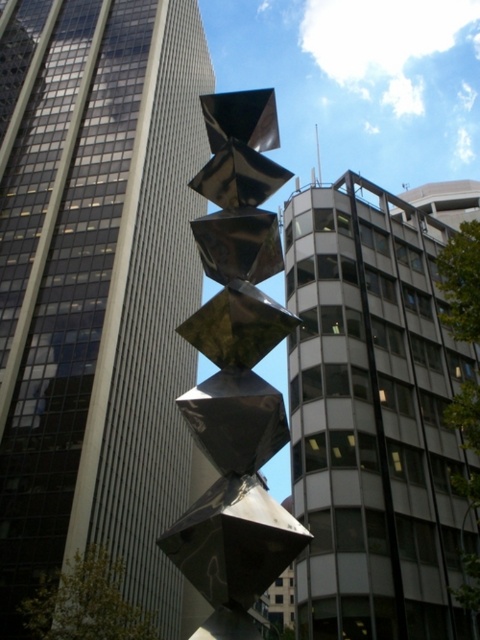
You are standing at the origin point in the urban setting. The smooth glass skyscraper at center is at coordinates 0.450, 0.204. If you want to walk directly towards it, in which cardinal direction should you head?

The smooth glass skyscraper at center is located at point (97, 288). Since the coordinate system typically has the origin at the bottom left, moving towards positive x increases eastward and positive y increases northward. Thus, to reach the skyscraper at (97, 288) from the origin, you should head northeast, as both x and y values are positive.

You are standing at the origin point in the urban setting. Which point, point (165, 321) or point (210, 269), is closer to you?

Point (210, 269) is closer to you because it is in front of point (165, 321).

You are an architect analyzing the urban layout. You observe the metallic glass building at center and the metallic reflective cubes at center. Which object is placed higher in the scene?

The metallic glass building at center is positioned over the metallic reflective cubes at center, meaning it is higher in the scene.